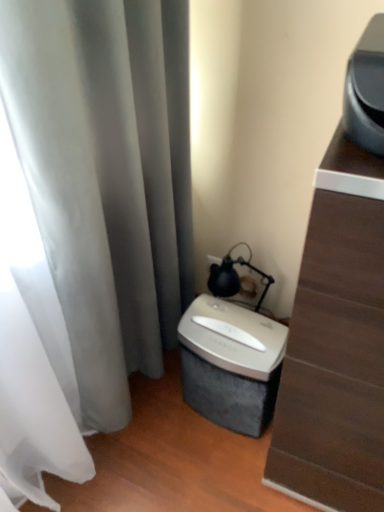
The image size is (384, 512). What do you see at coordinates (234, 276) in the screenshot?
I see `matte black lamp at upper right` at bounding box center [234, 276].

The width and height of the screenshot is (384, 512). Describe the element at coordinates (231, 362) in the screenshot. I see `silver metallic shredder at lower center` at that location.

Where is `matte black lamp at upper right`? This screenshot has width=384, height=512. matte black lamp at upper right is located at coordinates (234, 276).

Is matte black lamp at upper right oriented away from silver metallic shredder at lower center?

No, matte black lamp at upper right is not facing the opposite direction of silver metallic shredder at lower center.

Does point (245, 262) lie in front of point (325, 460)?

No, it is not.

Is matte black lamp at upper right shorter than silver metallic shredder at lower center?

Yes, matte black lamp at upper right is shorter than silver metallic shredder at lower center.

Are matte black lamp at upper right and silver metallic shredder at lower center making contact?

There is a gap between matte black lamp at upper right and silver metallic shredder at lower center.

Based on the photo, is matte black lamp at upper right placed right next to silver metallic shredder at lower center?

matte black lamp at upper right and silver metallic shredder at lower center are clearly separated.

Is matte black lamp at upper right to the right of silver metallic shredder at lower center from the viewer's perspective?

Yes.

Is matte black lamp at upper right not within silver metallic shredder at lower center?

Yes, matte black lamp at upper right is located beyond the bounds of silver metallic shredder at lower center.

Which is behind, silver metallic shredder at lower center or silver metallic shredder at lower center?

silver metallic shredder at lower center is more distant.

From a real-world perspective, is silver metallic shredder at lower center under silver metallic shredder at lower center?

Yes.

The height and width of the screenshot is (512, 384). What are the coordinates of `appliance on the left of silver metallic shredder at lower center` in the screenshot? It's located at (231, 362).

Is silver metallic shredder at lower center a part of silver metallic shredder at lower center?

No, silver metallic shredder at lower center is not surrounded by silver metallic shredder at lower center.

Is matte black lamp at upper right located within silver metallic shredder at lower center?

No, matte black lamp at upper right is not a part of silver metallic shredder at lower center.

Based on the photo, considering the relative sizes of silver metallic shredder at lower center and matte black lamp at upper right in the image provided, is silver metallic shredder at lower center bigger than matte black lamp at upper right?

Yes.

In terms of height, does silver metallic shredder at lower center look taller or shorter compared to matte black lamp at upper right?

In the image, silver metallic shredder at lower center appears to be taller than matte black lamp at upper right.

From the image's perspective, which one is positioned lower, silver metallic shredder at lower center or matte black lamp at upper right?

silver metallic shredder at lower center.

Is silver metallic shredder at lower center not close to silver metallic shredder at lower center?

Actually, silver metallic shredder at lower center and silver metallic shredder at lower center are a little close together.

Is silver metallic shredder at lower center taller than silver metallic shredder at lower center?

Yes, silver metallic shredder at lower center is taller than silver metallic shredder at lower center.

Can you tell me how much silver metallic shredder at lower center and silver metallic shredder at lower center differ in facing direction?

They differ by 6.8 degrees in their facing directions.

Considering the relative positions of silver metallic shredder at lower center and silver metallic shredder at lower center in the image provided, is silver metallic shredder at lower center to the right of silver metallic shredder at lower center from the viewer's perspective?

Correct, you'll find silver metallic shredder at lower center to the right of silver metallic shredder at lower center.

Could matte black lamp at upper right be considered to be inside silver metallic shredder at lower center?

No, matte black lamp at upper right is not surrounded by silver metallic shredder at lower center.

Which is more to the left, silver metallic shredder at lower center or matte black lamp at upper right?

From the viewer's perspective, matte black lamp at upper right appears more on the left side.

In the scene shown: From a real-world perspective, which object stands above the other?

Answer: silver metallic shredder at lower center, from a real-world perspective.

At what (x,y) coordinates should I click in order to perform the action: click on table lamp on the left of the silver metallic shredder at lower center. Please return your answer as a coordinate pair (x, y). The height and width of the screenshot is (512, 384). Looking at the image, I should click on (234, 276).

The height and width of the screenshot is (512, 384). What are the coordinates of `appliance in front of the matte black lamp at upper right` in the screenshot? It's located at (231, 362).

Estimate the real-world distances between objects in this image. Which object is closer to silver metallic shredder at lower center, matte black lamp at upper right or silver metallic shredder at lower center?

Among the two, silver metallic shredder at lower center is located nearer to silver metallic shredder at lower center.

Estimate the real-world distances between objects in this image. Which object is closer to silver metallic shredder at lower center, silver metallic shredder at lower center or matte black lamp at upper right?

The object closer to silver metallic shredder at lower center is silver metallic shredder at lower center.

Which object lies further to the anchor point matte black lamp at upper right, silver metallic shredder at lower center or silver metallic shredder at lower center?

The object further to matte black lamp at upper right is silver metallic shredder at lower center.

Considering their positions, is matte black lamp at upper right positioned further to silver metallic shredder at lower center than silver metallic shredder at lower center?

matte black lamp at upper right lies further to silver metallic shredder at lower center than the other object.

Considering their positions, is silver metallic shredder at lower center positioned further to silver metallic shredder at lower center than matte black lamp at upper right?

matte black lamp at upper right lies further to silver metallic shredder at lower center than the other object.

From the picture: Based on their spatial positions, is silver metallic shredder at lower center or silver metallic shredder at lower center closer to matte black lamp at upper right?

Answer: silver metallic shredder at lower center is closer to matte black lamp at upper right.

Identify the location of appliance located between silver metallic shredder at lower center and matte black lamp at upper right in the depth direction. (231, 362).